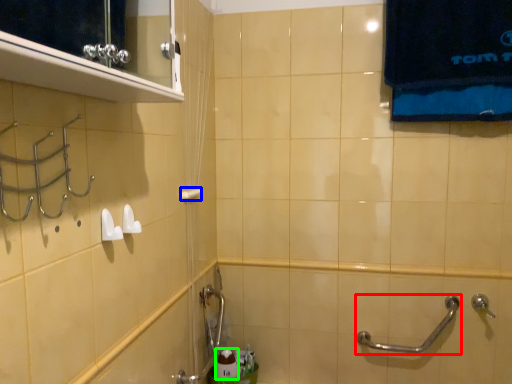
Question: Considering the real-world distances, which object is closest to door handle (highlighted by a red box)? towel bar (highlighted by a blue box) or toiletry (highlighted by a green box).

Choices:
 (A) towel bar
 (B) toiletry

Answer: (B)